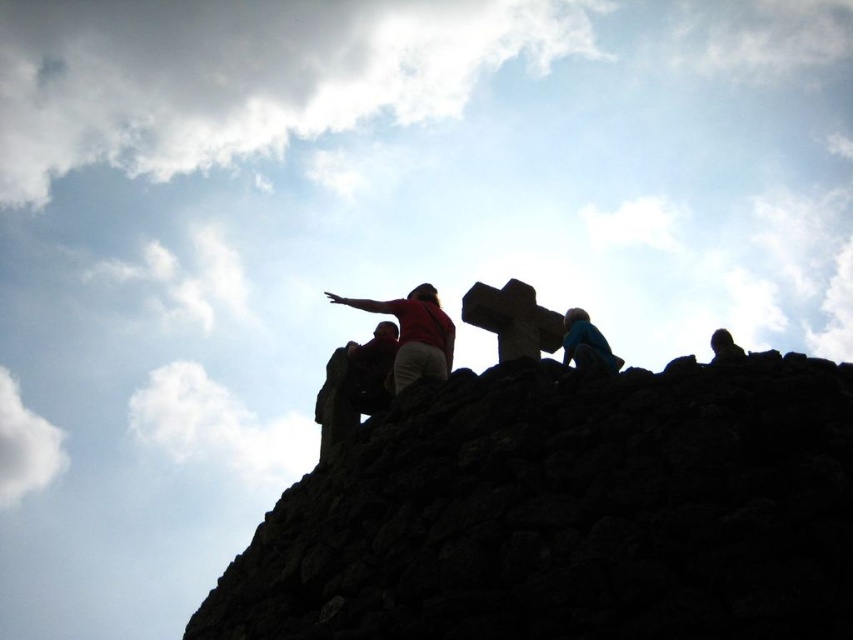
Question: Does dark stone wall at upper center have a lesser width compared to matte red arm at upper center?

Choices:
 (A) yes
 (B) no

Answer: (B)

Question: Does blue fabric person at upper center come in front of silhouette figure at upper right?

Choices:
 (A) yes
 (B) no

Answer: (B)

Question: Which object appears farthest from the camera in this image?

Choices:
 (A) matte red arm at upper center
 (B) blue fabric person at upper center
 (C) matte red shirt at center

Answer: (A)

Question: Does matte red shirt at center appear over silhouette figure at upper right?

Choices:
 (A) no
 (B) yes

Answer: (B)

Question: Among these objects, which one is farthest from the camera?

Choices:
 (A) blue fabric person at upper center
 (B) silhouette figure at upper right
 (C) matte red shirt at center

Answer: (C)

Question: Which object is farther from the camera taking this photo?

Choices:
 (A) blue fabric person at upper center
 (B) matte red arm at upper center
 (C) matte red shirt at center

Answer: (B)